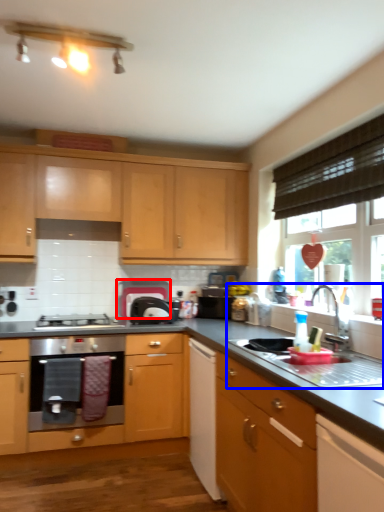
Question: Which object is further to the camera taking this photo, appliance (highlighted by a red box) or sink (highlighted by a blue box)?

Choices:
 (A) appliance
 (B) sink

Answer: (A)